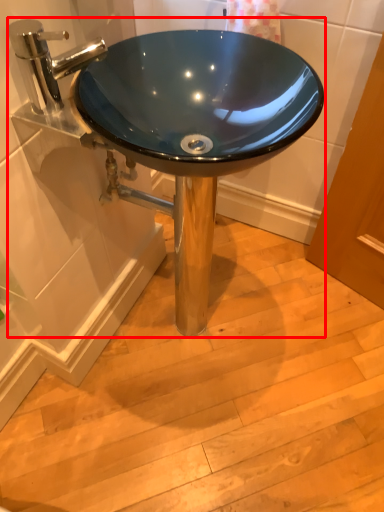
Question: From the image, what is the correct spatial relationship of sink (annotated by the red box) in relation to tap?

Choices:
 (A) right
 (B) left

Answer: (A)